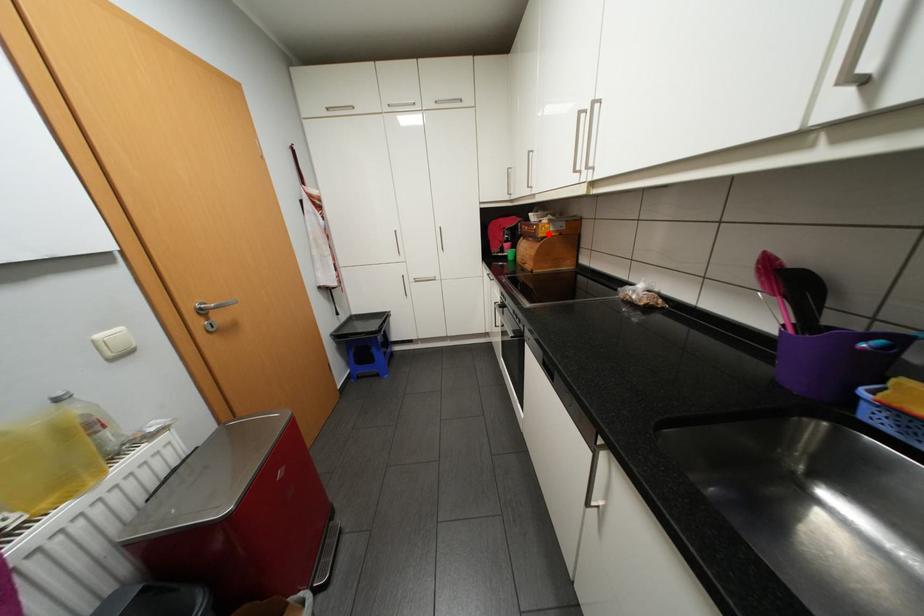
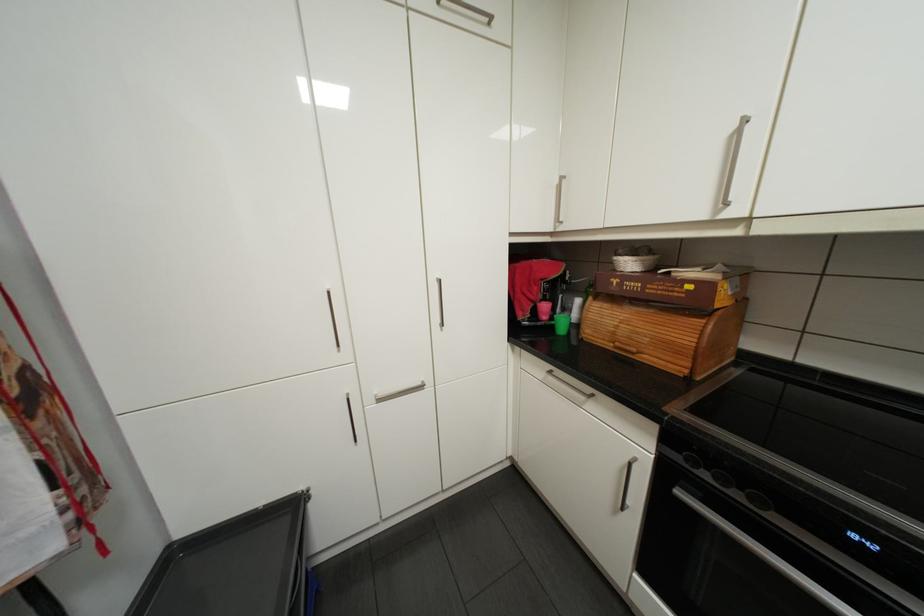
Locate, in the second image, the point that corresponds to the highlighted location in the first image.

(725, 305)